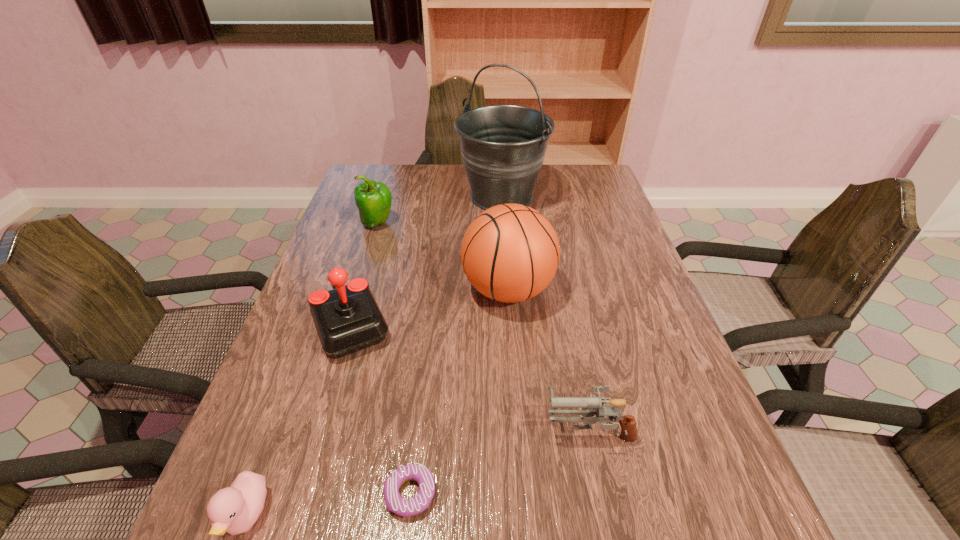
Where is `vacant space located on the front of the bell pepper`? The image size is (960, 540). vacant space located on the front of the bell pepper is located at coordinates (358, 287).

Where is `vacant space located at the barrel end of the third nearest object`? vacant space located at the barrel end of the third nearest object is located at coordinates (435, 430).

You are a GUI agent. You are given a task and a screenshot of the screen. Output one action in this format:
    pyautogui.click(x=<x>, y=<y>)
    Task: Click on the free region located at the barrel end of the third nearest object
    The width and height of the screenshot is (960, 540).
    Given the screenshot: What is the action you would take?
    [x=369, y=430]

Identify the location of vacant space located 0.170m at the barrel end of the third nearest object. (451, 430).

Identify the location of free region located on the left of the shortest object. Image resolution: width=960 pixels, height=540 pixels. (274, 494).

Locate an element on the screen. The height and width of the screenshot is (540, 960). object that is positioned at the far edge is located at coordinates (503, 147).

The height and width of the screenshot is (540, 960). I want to click on joystick at the left edge, so point(347,318).

The height and width of the screenshot is (540, 960). In order to click on bell pepper that is at the left edge in this screenshot , I will do `click(373, 199)`.

In order to click on object located at the right edge in this screenshot , I will do `click(591, 406)`.

Identify the location of vacant space at the far edge of the desktop. The image size is (960, 540). (450, 192).